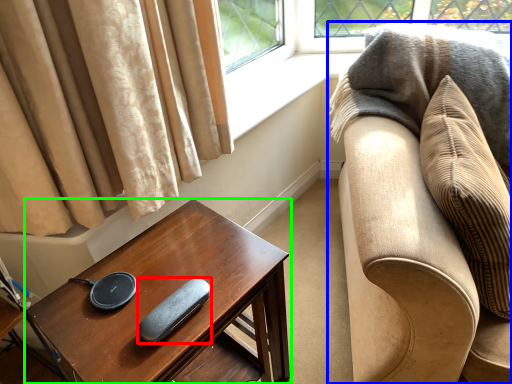
Question: Based on their relative distances, which object is nearer to pad (highlighted by a red box)? Choose from studio couch (highlighted by a blue box) and table (highlighted by a green box).

Choices:
 (A) studio couch
 (B) table

Answer: (B)